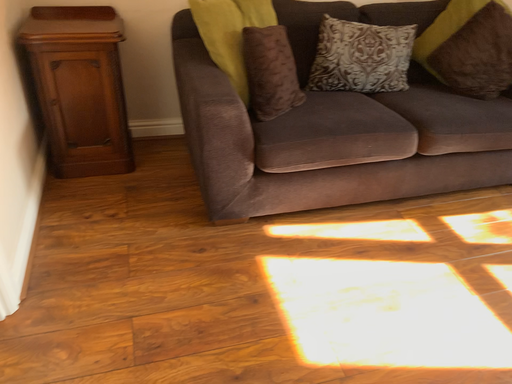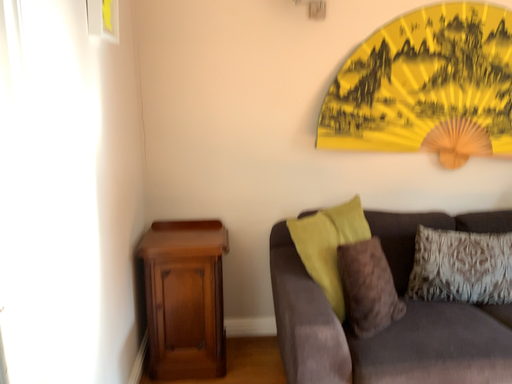
Question: Which way did the camera rotate in the video?

Choices:
 (A) rotated downward
 (B) rotated upward

Answer: (B)